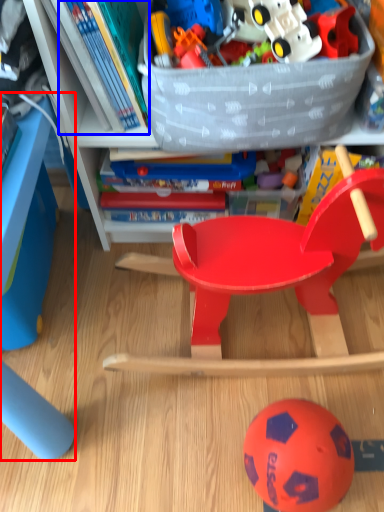
Question: Which point is closer to the camera, table (highlighted by a red box) or book (highlighted by a blue box)?

Choices:
 (A) table
 (B) book

Answer: (B)